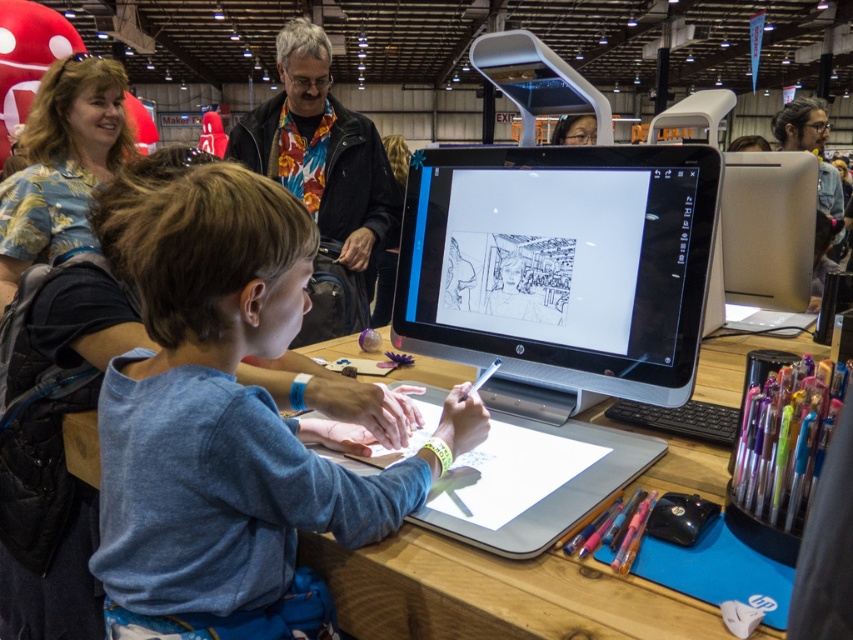
Question: Which is nearer to the satin silver monitor at center?

Choices:
 (A) blue cotton shirt at center
 (B) blue floral shirt at upper left

Answer: (A)

Question: Observing the image, what is the correct spatial positioning of satin silver monitor at center in reference to blue floral shirt at upper left?

Choices:
 (A) above
 (B) below

Answer: (B)

Question: Does satin silver monitor at center appear under blue floral shirt at upper left?

Choices:
 (A) no
 (B) yes

Answer: (B)

Question: Which of the following is the closest to the observer?

Choices:
 (A) satin silver monitor at center
 (B) blue cotton shirt at center

Answer: (B)

Question: Is satin silver monitor at center bigger than blue floral shirt at upper left?

Choices:
 (A) no
 (B) yes

Answer: (A)

Question: Which object appears farthest from the camera in this image?

Choices:
 (A) blue cotton shirt at center
 (B) satin silver monitor at center

Answer: (B)